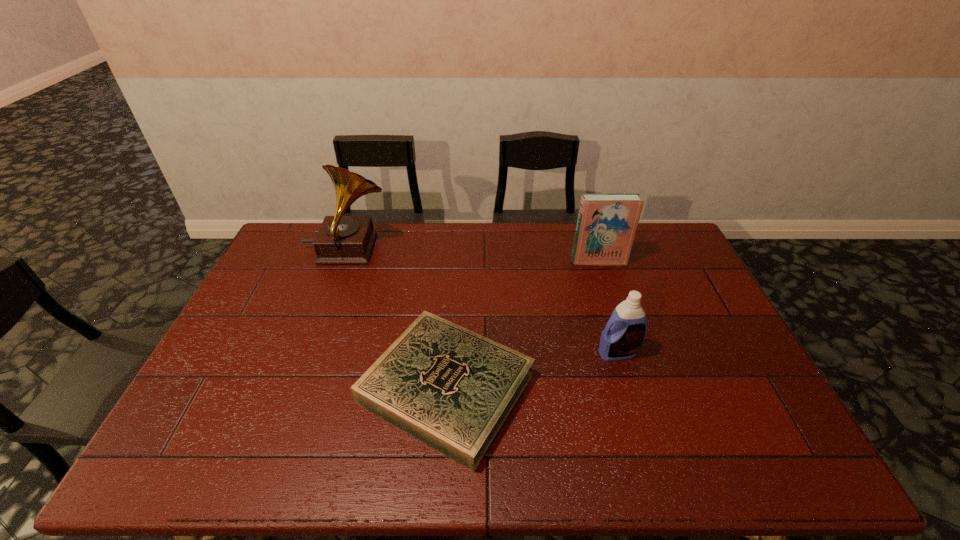
Image resolution: width=960 pixels, height=540 pixels. In order to click on vacant region between the phonograph record and the right hardback book in this screenshot , I will do `click(472, 256)`.

Choose which object is the second nearest neighbor to the shorter hardback book. Please provide its 2D coordinates. Your answer should be formatted as a tuple, i.e. [(x, y)], where the tuple contains the x and y coordinates of a point satisfying the conditions above.

[(341, 239)]

Locate an element on the screen. This screenshot has width=960, height=540. the third closest object to the right hardback book is located at coordinates (341, 239).

Find the location of a particular element. vacant space that satisfies the following two spatial constraints: 1. on the back side of the third object from right to left; 2. from the horn of the tallest object is located at coordinates (456, 251).

What are the coordinates of `free space in the image that satisfies the following two spatial constraints: 1. on the back side of the detergent; 2. from the horn of the tallest object` in the screenshot? It's located at (588, 251).

The width and height of the screenshot is (960, 540). What are the coordinates of `blank area in the image that satisfies the following two spatial constraints: 1. from the horn of the second object from left to right; 2. on the left side of the phonograph record` in the screenshot? It's located at coord(296,388).

This screenshot has width=960, height=540. Find the location of `vacant space that satisfies the following two spatial constraints: 1. from the horn of the leftmost object; 2. on the right side of the detergent`. vacant space that satisfies the following two spatial constraints: 1. from the horn of the leftmost object; 2. on the right side of the detergent is located at coordinates (309, 353).